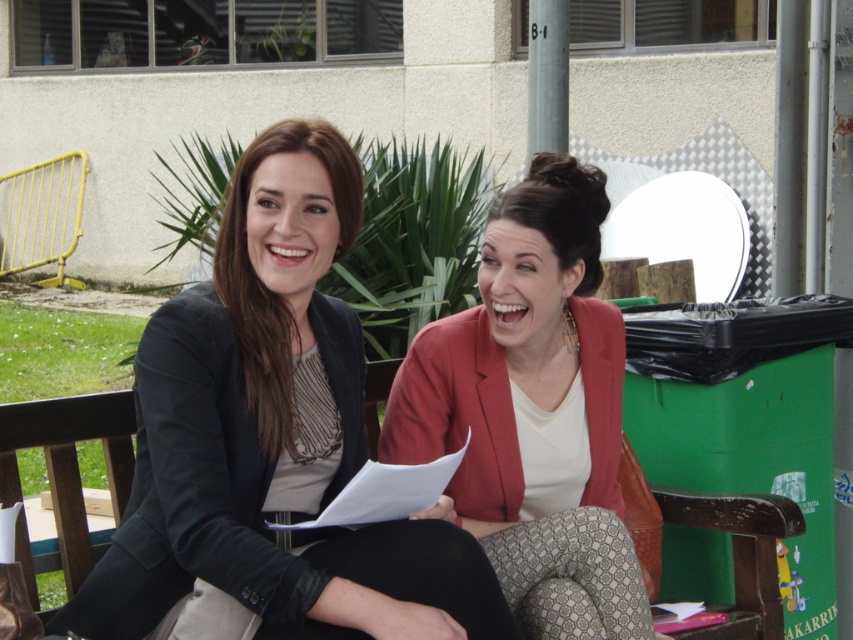
Is point (271, 403) more distant than point (76, 476)?

No.

Can you confirm if matte black blazer at center is thinner than wooden park bench at center?

Incorrect, matte black blazer at center's width is not less than wooden park bench at center's.

What do you see at coordinates (273, 436) in the screenshot? This screenshot has height=640, width=853. I see `matte black blazer at center` at bounding box center [273, 436].

Where is `matte black blazer at center`? This screenshot has height=640, width=853. matte black blazer at center is located at coordinates (273, 436).

Consider the image. Does matte black blazer at center have a larger size compared to matte red blazer at center?

Indeed, matte black blazer at center has a larger size compared to matte red blazer at center.

Does point (144, 337) come in front of point (527, 342)?

That is True.

Is point (258, 433) positioned before point (525, 188)?

That is True.

Image resolution: width=853 pixels, height=640 pixels. I want to click on matte black blazer at center, so click(273, 436).

Who is higher up, matte red blazer at center or wooden park bench at center?

matte red blazer at center is above.

The height and width of the screenshot is (640, 853). Describe the element at coordinates (532, 412) in the screenshot. I see `matte red blazer at center` at that location.

Image resolution: width=853 pixels, height=640 pixels. Describe the element at coordinates (532, 412) in the screenshot. I see `matte red blazer at center` at that location.

Identify the location of matte red blazer at center. (532, 412).